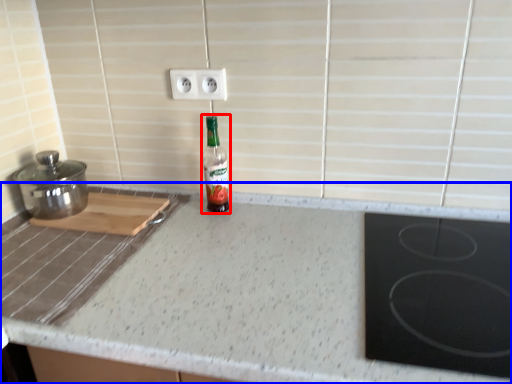
Question: Which point is further to the camera, bottle (highlighted by a red box) or countertop (highlighted by a blue box)?

Choices:
 (A) bottle
 (B) countertop

Answer: (A)